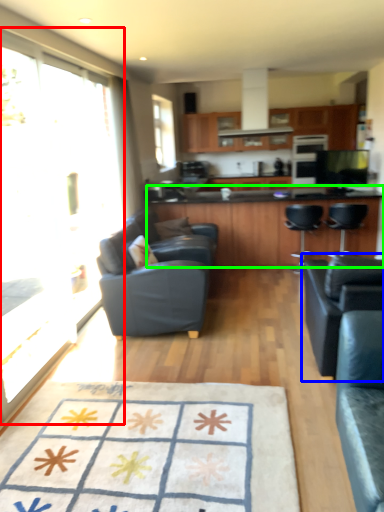
Question: Which object is the farthest from glass door (highlighted by a red box)? Choose among these: chair (highlighted by a blue box) or countertop (highlighted by a green box).

Choices:
 (A) chair
 (B) countertop

Answer: (A)